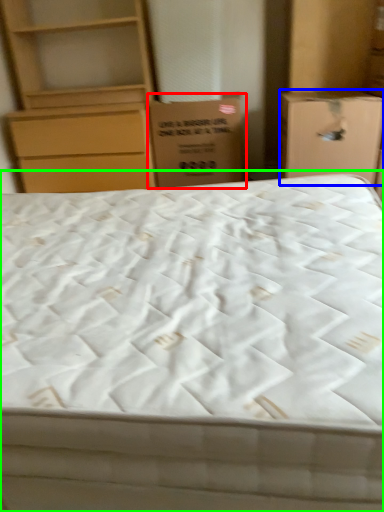
Question: Estimate the real-world distances between objects in this image. Which object is farther from cardboard box (highlighted by a red box), cardboard box (highlighted by a blue box) or bed (highlighted by a green box)?

Choices:
 (A) cardboard box
 (B) bed

Answer: (B)